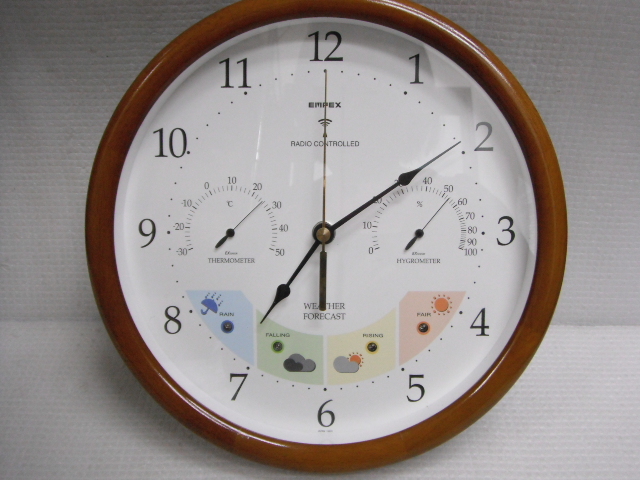
At what (x,y) coordinates should I click in order to perform the action: click on papertowels. Please return your answer as a coordinate pair (x, y). The height and width of the screenshot is (480, 640). Looking at the image, I should click on (582, 97).